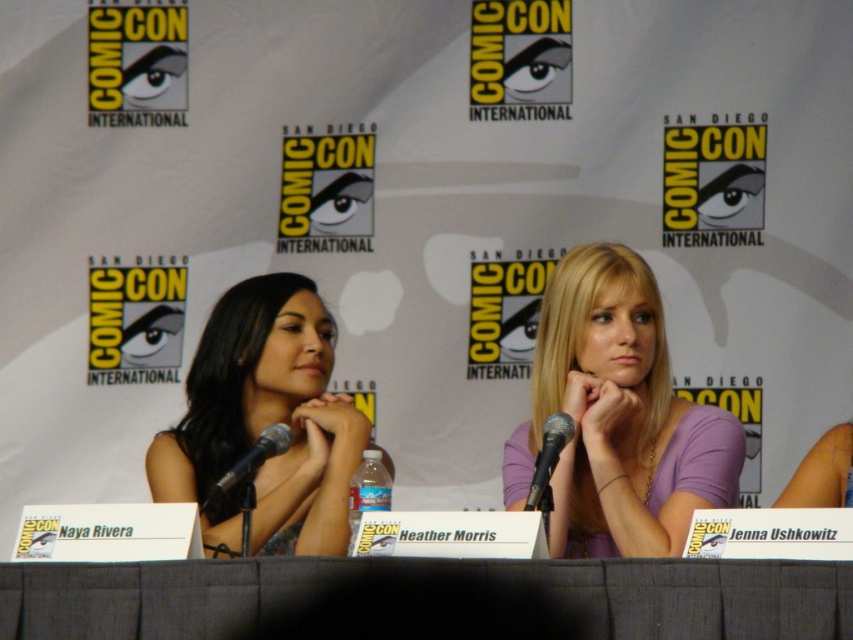
You are a photographer standing at the camera position. You need to place a new microphone that is 0.5 meters long between the existing black metallic microphone at center and the camera. Is there enough space to place it without moving the existing microphone?

A: The distance between the black metallic microphone at center and the camera is 2.76 meters. Since the new microphone is only 0.5 meters long, there is sufficient space to place it between them without moving the existing microphone.

You are standing at the point labeled point (x=524, y=467) and want to take a photo of the Comic Con panel discussion. The camera you are using has a focal length of 50mm and a sensor size of 24mm x 36mm. What is the minimum distance you need to be from the panel to ensure the entire scene fits in the frame?

The point labeled point (x=524, y=467) is 3.41 meters away from the camera. To ensure the entire scene fits in the frame, you need to be at least 3.41 meters away from the panel.

You are attending a panel at ComicCon and notice a purple matte shirt at center and a metallic silver microphone at center. Which object is positioned higher in relation to the other?

Answer: The purple matte shirt at center is above the metallic silver microphone at center.